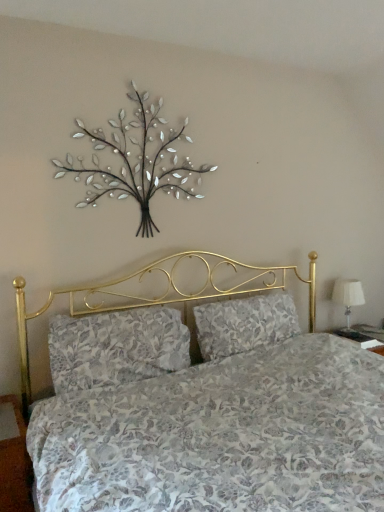
Question: Is white fabric lampshade at right shorter than floral fabric pillow at center, the second pillow from the left?

Choices:
 (A) yes
 (B) no

Answer: (B)

Question: From a real-world perspective, is white fabric lampshade at right under floral fabric pillow at center, which is the first pillow from right to left?

Choices:
 (A) no
 (B) yes

Answer: (B)

Question: Can you confirm if white fabric lampshade at right is wider than floral fabric pillow at center, the second pillow from the left?

Choices:
 (A) no
 (B) yes

Answer: (A)

Question: From the image's perspective, does white fabric lampshade at right appear higher than floral fabric pillow at center, the second pillow from the left?

Choices:
 (A) no
 (B) yes

Answer: (B)

Question: Is white fabric lampshade at right touching floral fabric pillow at center, which is the first pillow from right to left?

Choices:
 (A) no
 (B) yes

Answer: (A)

Question: Is metallic silver tree at upper center wider or thinner than floral fabric pillow at center, the second pillow from the left?

Choices:
 (A) wide
 (B) thin

Answer: (B)

Question: Considering the relative positions of metallic silver tree at upper center and floral fabric pillow at center, which is the first pillow from right to left, in the image provided, is metallic silver tree at upper center to the left or to the right of floral fabric pillow at center, which is the first pillow from right to left,?

Choices:
 (A) left
 (B) right

Answer: (A)

Question: Which is correct: metallic silver tree at upper center is inside floral fabric pillow at center, which is the first pillow from right to left, or outside of it?

Choices:
 (A) inside
 (B) outside

Answer: (B)

Question: From the image's perspective, is metallic silver tree at upper center above or below floral fabric pillow at center, which is the first pillow from right to left?

Choices:
 (A) below
 (B) above

Answer: (B)

Question: From their relative heights in the image, would you say floral fabric pillow at center, which is the first pillow in left-to-right order, is taller or shorter than metallic silver tree at upper center?

Choices:
 (A) short
 (B) tall

Answer: (A)

Question: In the image, is floral fabric pillow at center, which is the first pillow in left-to-right order, positioned in front of or behind metallic silver tree at upper center?

Choices:
 (A) front
 (B) behind

Answer: (A)

Question: Is point (100, 357) positioned closer to the camera than point (155, 137)?

Choices:
 (A) farther
 (B) closer

Answer: (B)

Question: From a real-world perspective, is floral fabric pillow at center, positioned as the 2th pillow in right-to-left order, physically located above or below metallic silver tree at upper center?

Choices:
 (A) above
 (B) below

Answer: (B)

Question: Considering their positions, is floral fabric pillow at center, which is the first pillow in left-to-right order, located in front of or behind floral fabric pillow at center, the second pillow from the left?

Choices:
 (A) behind
 (B) front

Answer: (B)

Question: Does point (51, 378) appear closer or farther from the camera than point (195, 333)?

Choices:
 (A) closer
 (B) farther

Answer: (A)